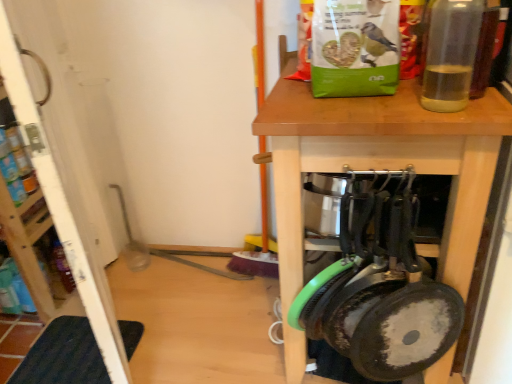
The height and width of the screenshot is (384, 512). I want to click on vacant region to the right of dark blue rubber mat at lower left, so click(x=175, y=337).